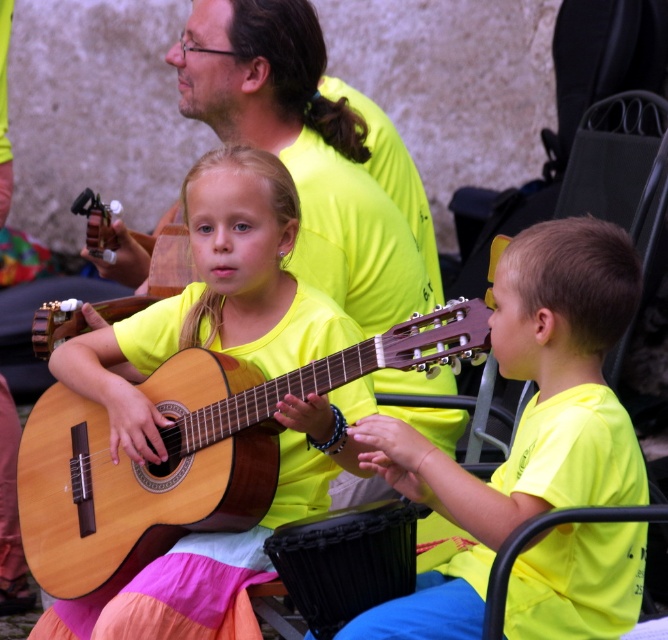
Question: Can you confirm if yellow matte guitar at right is positioned to the right of natural wood guitar at center?

Choices:
 (A) yes
 (B) no

Answer: (A)

Question: Does yellow matte guitar at right come behind natural wood guitar at center?

Choices:
 (A) yes
 (B) no

Answer: (B)

Question: Is yellow matte guitar at right further to camera compared to natural wood guitar at center?

Choices:
 (A) yes
 (B) no

Answer: (B)

Question: Which point appears closest to the camera in this image?

Choices:
 (A) (246, 456)
 (B) (520, 362)

Answer: (B)

Question: Which point is farther to the camera?

Choices:
 (A) yellow matte guitar at right
 (B) natural wood guitar at center

Answer: (B)